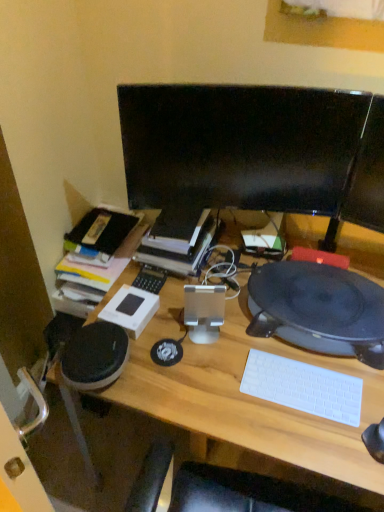
Question: Is the surface of black glossy monitor at center in direct contact with wooden desk at center?

Choices:
 (A) yes
 (B) no

Answer: (B)

Question: From a real-world perspective, is black glossy monitor at center located beneath wooden desk at center?

Choices:
 (A) no
 (B) yes

Answer: (A)

Question: Considering the relative sizes of black glossy monitor at center and wooden desk at center in the image provided, is black glossy monitor at center thinner than wooden desk at center?

Choices:
 (A) no
 (B) yes

Answer: (B)

Question: Is black glossy monitor at center in front of wooden desk at center?

Choices:
 (A) yes
 (B) no

Answer: (B)

Question: Is black glossy monitor at center aimed at wooden desk at center?

Choices:
 (A) yes
 (B) no

Answer: (A)

Question: In the image, is black matte record player at right on the left side or the right side of black glossy monitor at center?

Choices:
 (A) left
 (B) right

Answer: (B)

Question: From a real-world perspective, is black matte record player at right physically located above or below black glossy monitor at center?

Choices:
 (A) below
 (B) above

Answer: (A)

Question: Which is correct: black matte record player at right is inside black glossy monitor at center, or outside of it?

Choices:
 (A) inside
 (B) outside

Answer: (B)

Question: Is point (334, 308) positioned closer to the camera than point (283, 201)?

Choices:
 (A) farther
 (B) closer

Answer: (B)

Question: Looking at their shapes, would you say black glossy monitor at center is wider or thinner than wooden desk at center?

Choices:
 (A) thin
 (B) wide

Answer: (A)

Question: From a real-world perspective, is black glossy monitor at center physically located above or below wooden desk at center?

Choices:
 (A) above
 (B) below

Answer: (A)

Question: Is black glossy monitor at center inside or outside of wooden desk at center?

Choices:
 (A) inside
 (B) outside

Answer: (B)

Question: Is black glossy monitor at center in front of or behind wooden desk at center in the image?

Choices:
 (A) front
 (B) behind

Answer: (B)

Question: From the image's perspective, is black matte record player at right located above or below white plastic keyboard at lower right?

Choices:
 (A) above
 (B) below

Answer: (A)

Question: Considering the relative positions of black matte record player at right and white plastic keyboard at lower right in the image provided, is black matte record player at right to the left or to the right of white plastic keyboard at lower right?

Choices:
 (A) left
 (B) right

Answer: (B)